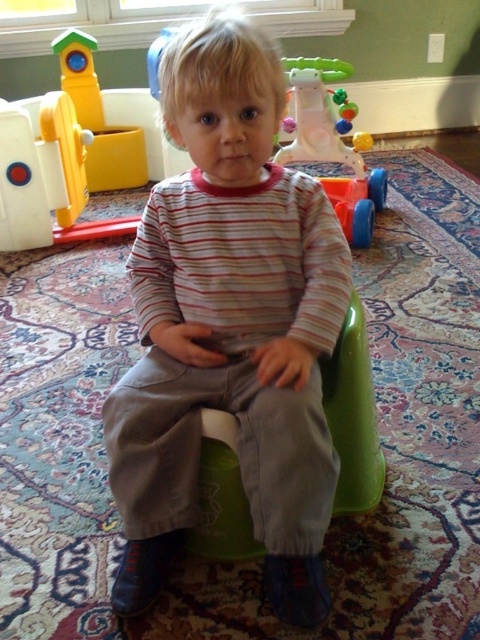
Does matte plastic walker at upper center appear under green plastic chair at center?

Actually, matte plastic walker at upper center is above green plastic chair at center.

Looking at this image, between matte plastic walker at upper center and green plastic chair at center, which one has less height?

With less height is green plastic chair at center.

This screenshot has width=480, height=640. I want to click on matte plastic walker at upper center, so click(x=71, y=150).

Does matte striped shirt at center have a greater width compared to plastic walker at upper center?

Incorrect, matte striped shirt at center's width does not surpass plastic walker at upper center's.

Is point (242, 172) positioned in front of point (331, 138)?

Yes, point (242, 172) is closer to viewer.

At what (x,y) coordinates should I click in order to perform the action: click on matte striped shirt at center. Please return your answer as a coordinate pair (x, y). The width and height of the screenshot is (480, 640). Looking at the image, I should click on (229, 326).

Can you confirm if matte plastic walker at upper center is shorter than plastic walker at upper center?

No.

Who is positioned more to the left, matte plastic walker at upper center or plastic walker at upper center?

matte plastic walker at upper center

Measure the distance between point (355, 234) and camera.

Point (355, 234) is 7.08 feet from camera.

Identify the location of matte plastic walker at upper center. (71, 150).